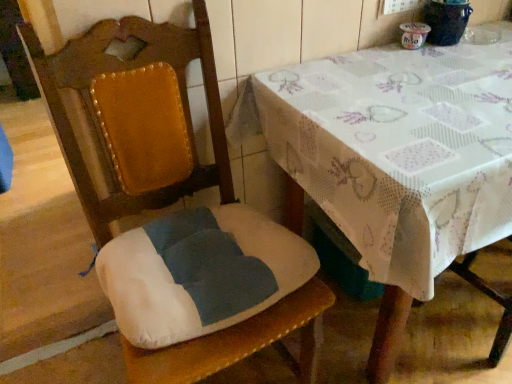
Question: Is velvet cushioned chair at center positioned before white printed tablecloth at upper right?

Choices:
 (A) no
 (B) yes

Answer: (B)

Question: From the image's perspective, is velvet cushioned chair at center on white printed tablecloth at upper right?

Choices:
 (A) no
 (B) yes

Answer: (A)

Question: Can you confirm if velvet cushioned chair at center is shorter than white printed tablecloth at upper right?

Choices:
 (A) no
 (B) yes

Answer: (A)

Question: Is velvet cushioned chair at center not close to white printed tablecloth at upper right?

Choices:
 (A) no
 (B) yes

Answer: (A)

Question: Is velvet cushioned chair at center oriented towards white printed tablecloth at upper right?

Choices:
 (A) no
 (B) yes

Answer: (A)

Question: Considering the relative positions of velvet cushioned chair at center and white printed tablecloth at upper right in the image provided, is velvet cushioned chair at center to the left of white printed tablecloth at upper right from the viewer's perspective?

Choices:
 (A) no
 (B) yes

Answer: (B)

Question: From a real-world perspective, is white printed tablecloth at upper right positioned over velvet cushioned chair at center based on gravity?

Choices:
 (A) yes
 (B) no

Answer: (B)

Question: Considering the relative sizes of white printed tablecloth at upper right and velvet cushioned chair at center in the image provided, is white printed tablecloth at upper right smaller than velvet cushioned chair at center?

Choices:
 (A) yes
 (B) no

Answer: (B)

Question: Is white printed tablecloth at upper right directly adjacent to velvet cushioned chair at center?

Choices:
 (A) yes
 (B) no

Answer: (B)

Question: Is white printed tablecloth at upper right in front of velvet cushioned chair at center?

Choices:
 (A) yes
 (B) no

Answer: (B)

Question: Is white printed tablecloth at upper right located outside velvet cushioned chair at center?

Choices:
 (A) yes
 (B) no

Answer: (A)

Question: Is white printed tablecloth at upper right bigger than velvet cushioned chair at center?

Choices:
 (A) no
 (B) yes

Answer: (B)

Question: Considering their positions, is white printed tablecloth at upper right located in front of or behind velvet cushioned chair at center?

Choices:
 (A) behind
 (B) front

Answer: (A)